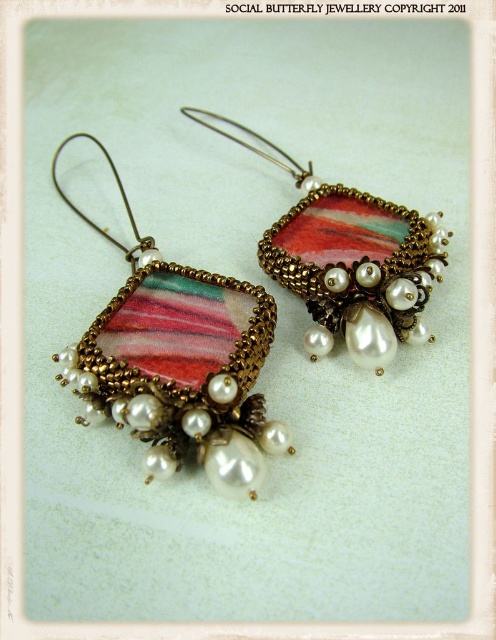
Question: Among these objects, which one is farthest from the camera?

Choices:
 (A) multicolored beaded pendant at center
 (B) matte pink fabric earring at left

Answer: (A)

Question: Is matte pink fabric earring at left above multicolored beaded pendant at center?

Choices:
 (A) no
 (B) yes

Answer: (A)

Question: Does matte pink fabric earring at left have a smaller size compared to multicolored beaded pendant at center?

Choices:
 (A) yes
 (B) no

Answer: (B)

Question: Can you confirm if matte pink fabric earring at left is positioned above multicolored beaded pendant at center?

Choices:
 (A) yes
 (B) no

Answer: (B)